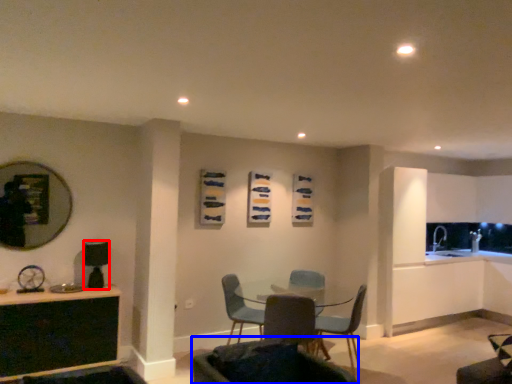
Question: Among these objects, which one is farthest to the camera, appliance (highlighted by a red box) or chair (highlighted by a blue box)?

Choices:
 (A) appliance
 (B) chair

Answer: (A)